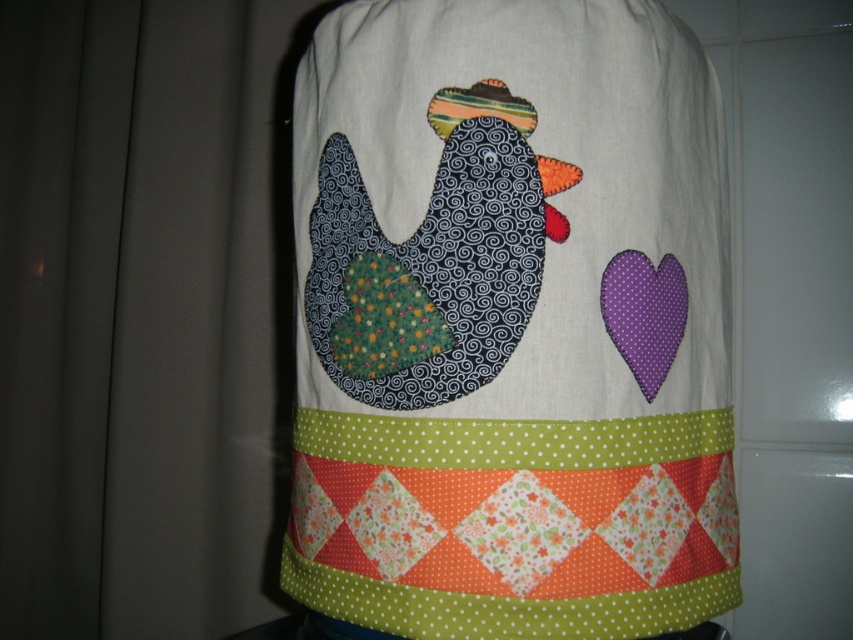
Consider the image. You are an interior designer planning to place both the quilted fabric chicken at center and the textured dark blue chicken at center on a shelf. Which chicken will require more space on the shelf?

The quilted fabric chicken at center requires more space on the shelf because it has a larger size compared to the textured dark blue chicken at center.

You are an interior designer arranging a nursery. You have a quilted fabric chicken at center and a textured dark blue chicken at center on a wall. Which chicken is positioned lower on the wall?

The quilted fabric chicken at center is positioned lower on the wall than the textured dark blue chicken at center.